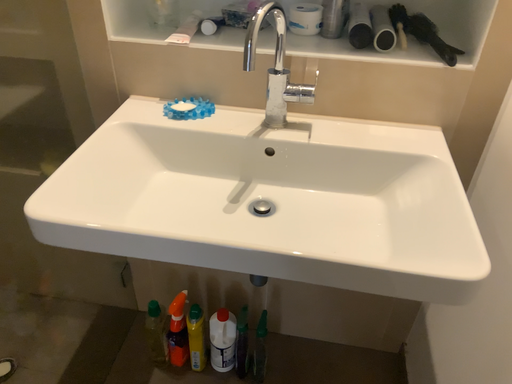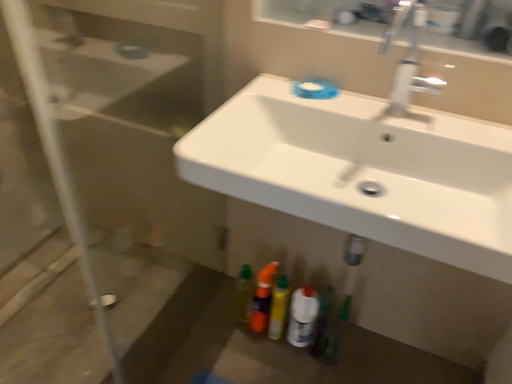
Question: How did the camera likely rotate when shooting the video?

Choices:
 (A) rotated right
 (B) rotated left

Answer: (B)